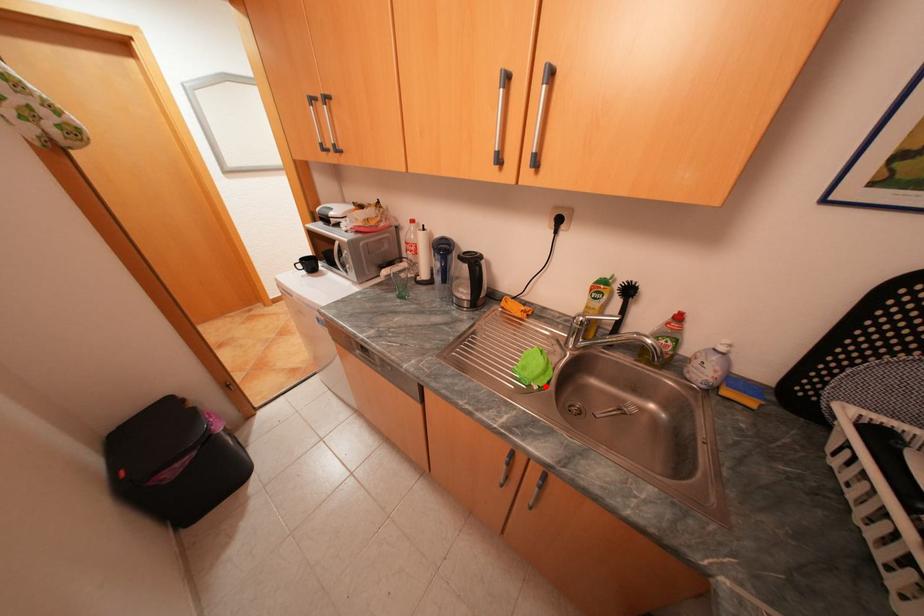
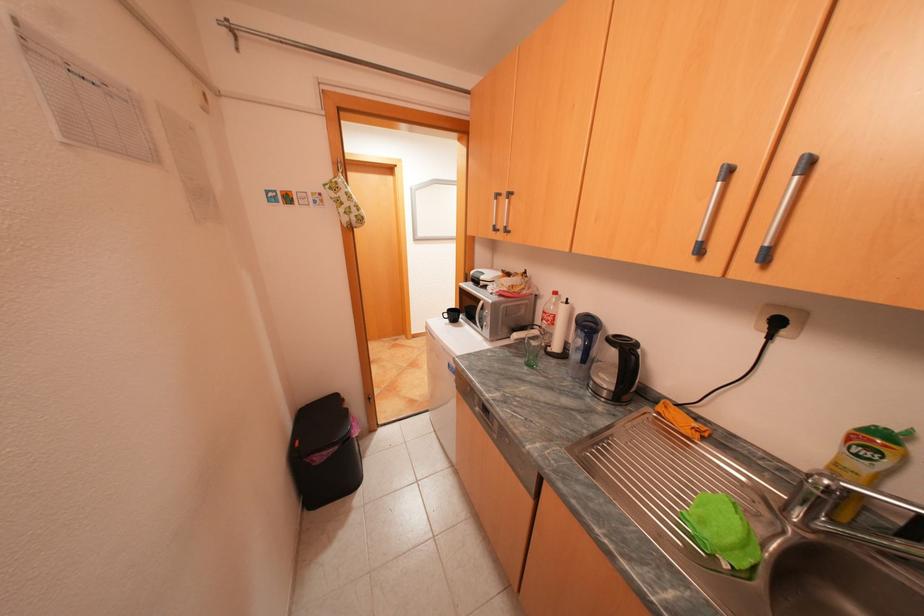
Question: I am providing you with two images of the same scene from different viewpoints. A red point is shown in image1. For the corresponding object point in image2, is it positioned nearer or farther from the camera?

Choices:
 (A) Nearer
 (B) Farther

Answer: (A)